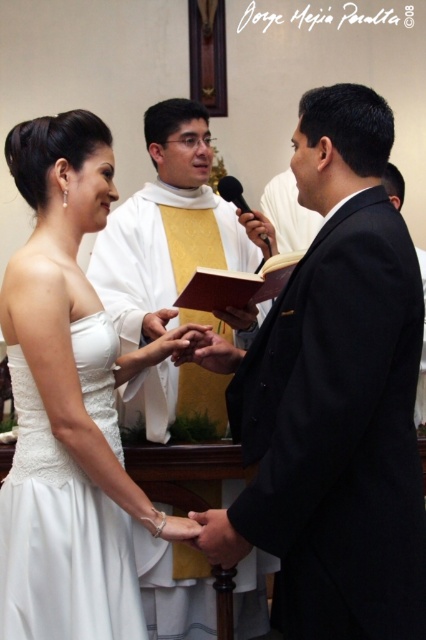
You are a photographer positioned at the entrance of the ceremony hall. You need to capture a closeup shot of the white satin dress at center. Based on its position, which direction should you move to get a better angle?

Since the white satin dress at center is located at point 0.630 on the x and 0.157 on the y coordinate, moving slightly to the right and forward would position you closer for a better angle without obstructing the ceremony.

You are a photographer at the wedding ceremony. You want to capture a photo that includes both the matte black suit at center and the silver metallic ring at lower center. However, you can only focus on one object clearly. Which object should you focus on to ensure it appears sharp in the photo?

The matte black suit at center is much taller than the silver metallic ring at lower center, so focusing on the matte black suit at center would ensure it appears sharp in the photo.